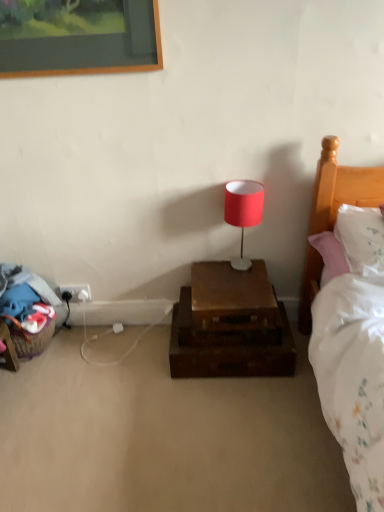
Question: Should I look upward or downward to see white soft pillow at right?

Choices:
 (A) down
 (B) up

Answer: (B)

Question: Should I look upward or downward to see matte red lampshade at center?

Choices:
 (A) down
 (B) up

Answer: (B)

Question: Does white soft pillow at right have a lesser height compared to white plastic electrical outlet at lower left?

Choices:
 (A) no
 (B) yes

Answer: (A)

Question: Can you confirm if white soft pillow at right is wider than white plastic electrical outlet at lower left?

Choices:
 (A) yes
 (B) no

Answer: (A)

Question: Considering the relative sizes of white soft pillow at right and white plastic electrical outlet at lower left in the image provided, is white soft pillow at right bigger than white plastic electrical outlet at lower left?

Choices:
 (A) yes
 (B) no

Answer: (A)

Question: From a real-world perspective, is white soft pillow at right on top of white plastic electrical outlet at lower left?

Choices:
 (A) no
 (B) yes

Answer: (B)

Question: Is white soft pillow at right positioned in front of white plastic electrical outlet at lower left?

Choices:
 (A) no
 (B) yes

Answer: (B)

Question: Is white plastic electrical outlet at lower left a part of white soft pillow at right?

Choices:
 (A) yes
 (B) no

Answer: (B)

Question: From the image's perspective, is wooden suitcase at center below white soft pillow at right?

Choices:
 (A) yes
 (B) no

Answer: (A)

Question: Could you tell me if wooden suitcase at center is facing white soft pillow at right?

Choices:
 (A) yes
 (B) no

Answer: (B)

Question: Does wooden suitcase at center have a greater width compared to white soft pillow at right?

Choices:
 (A) no
 (B) yes

Answer: (A)

Question: Is wooden suitcase at center smaller than white soft pillow at right?

Choices:
 (A) no
 (B) yes

Answer: (A)

Question: From a real-world perspective, is wooden suitcase at center below white soft pillow at right?

Choices:
 (A) no
 (B) yes

Answer: (B)

Question: Is white soft pillow at right at the back of wooden suitcase at center?

Choices:
 (A) yes
 (B) no

Answer: (B)

Question: Is wooden suitcase at center in contact with matte red lampshade at center?

Choices:
 (A) yes
 (B) no

Answer: (B)